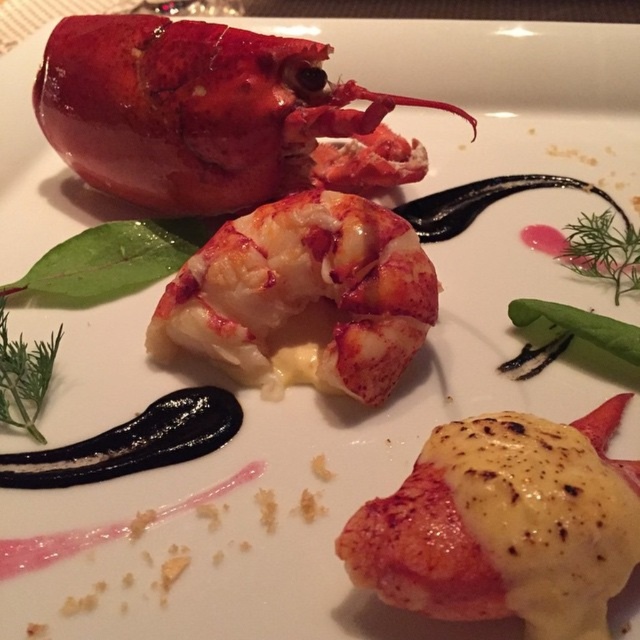
Where is the shiny red lobster at upper left located on the plate?

The shiny red lobster at upper left is located at point coordinates of 0.172 in the x axis and 0.305 in the y axis.

You are a food critic analyzing the placement of the savory lobster tail at center on the plate. Based on the coordinates provided, can you determine if it is positioned closer to the top or bottom edge of the plate?

The savory lobster tail at center is located at coordinates 0.820 on the x and 0.791 on the y axis. Since the y coordinate is closer to 1, which typically represents the bottom edge in such coordinate systems, the lobster tail is positioned closer to the bottom edge of the plate.

Looking at this image, you are a food critic evaluating the presentation of this dish. The shiny red lobster at upper left and the savory lobster tail at center are both part of the dish. Which part of the lobster is placed higher on the plate?

The shiny red lobster at upper left is positioned over the savory lobster tail at center, so it is placed higher on the plate.